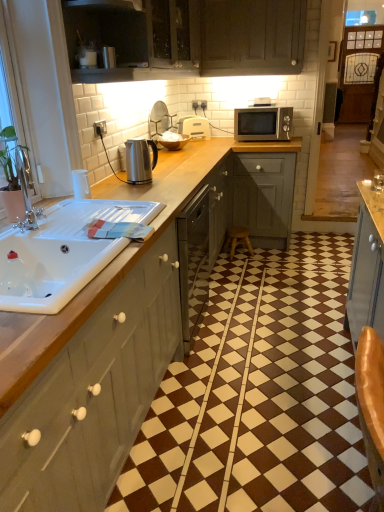
Question: From a real-world perspective, does satin silver kettle at upper center, which is the 2th appliance in top-to-bottom order, sit lower than matte wood cabinet at upper center, the 2th cabinetry from the top?

Choices:
 (A) no
 (B) yes

Answer: (B)

Question: Does satin silver kettle at upper center, placed as the second appliance when sorted from bottom to top, have a lesser width compared to matte wood cabinet at upper center, positioned as the second cabinetry in bottom-to-top order?

Choices:
 (A) no
 (B) yes

Answer: (B)

Question: Does satin silver kettle at upper center, placed as the second appliance when sorted from bottom to top, have a greater height compared to matte wood cabinet at upper center, the 2th cabinetry from the top?

Choices:
 (A) yes
 (B) no

Answer: (B)

Question: Is satin silver kettle at upper center, which is the 2th appliance in top-to-bottom order, far away from matte wood cabinet at upper center, the 2th cabinetry from the top?

Choices:
 (A) yes
 (B) no

Answer: (B)

Question: Could you tell me if satin silver kettle at upper center, which is the 2th appliance in top-to-bottom order, is turned towards matte wood cabinet at upper center, the 2th cabinetry from the top?

Choices:
 (A) yes
 (B) no

Answer: (B)

Question: From the image's perspective, would you say satin silver kettle at upper center, placed as the second appliance when sorted from bottom to top, is positioned over matte wood cabinet at upper center, the 2th cabinetry from the top?

Choices:
 (A) yes
 (B) no

Answer: (B)

Question: Could you tell me if satin silver kettle at upper center, placed as the second appliance when sorted from bottom to top, is facing white glossy sink at left?

Choices:
 (A) yes
 (B) no

Answer: (B)

Question: Considering the relative positions of satin silver kettle at upper center, which is the 2th appliance in top-to-bottom order, and white glossy sink at left in the image provided, is satin silver kettle at upper center, which is the 2th appliance in top-to-bottom order, to the left of white glossy sink at left from the viewer's perspective?

Choices:
 (A) yes
 (B) no

Answer: (B)

Question: Is satin silver kettle at upper center, which is the 2th appliance in top-to-bottom order, not within white glossy sink at left?

Choices:
 (A) no
 (B) yes

Answer: (B)

Question: Considering the relative sizes of satin silver kettle at upper center, the second appliance viewed from the front, and white glossy sink at left in the image provided, is satin silver kettle at upper center, the second appliance viewed from the front, wider than white glossy sink at left?

Choices:
 (A) no
 (B) yes

Answer: (A)

Question: Does satin silver kettle at upper center, placed as the second appliance when sorted from bottom to top, have a lesser height compared to white glossy sink at left?

Choices:
 (A) no
 (B) yes

Answer: (A)

Question: Does satin silver kettle at upper center, which is the 2th appliance in top-to-bottom order, have a smaller size compared to white glossy sink at left?

Choices:
 (A) no
 (B) yes

Answer: (B)

Question: Is satin silver kettle at center, placed as the first appliance when sorted from bottom to top, wider than matte wood cabinet at upper center, the 2th cabinetry from the top?

Choices:
 (A) yes
 (B) no

Answer: (B)